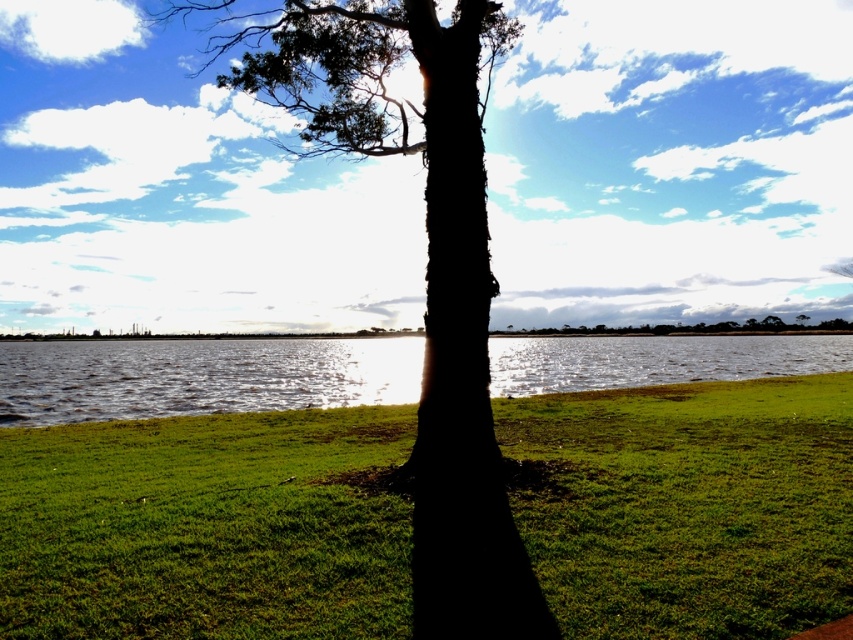
Can you confirm if green grassy at center is shorter than glistening water at center?

Yes, green grassy at center is shorter than glistening water at center.

Is the position of green grassy at center more distant than that of glistening water at center?

No, it is in front of glistening water at center.

Is point (624, 634) farther from viewer compared to point (625, 364)?

No, it is not.

This screenshot has width=853, height=640. In order to click on green grassy at center in this screenshot , I will do `click(207, 525)`.

Who is higher up, green grassy at center or dark bark tree at center?

dark bark tree at center is higher up.

Who is shorter, green grassy at center or dark bark tree at center?

green grassy at center

Where is `green grassy at center`? green grassy at center is located at coordinates (207, 525).

Is dark bark tree at center positioned before glistening water at center?

Yes, it is.

Is dark bark tree at center smaller than glistening water at center?

Actually, dark bark tree at center might be larger than glistening water at center.

You are a GUI agent. You are given a task and a screenshot of the screen. Output one action in this format:
    pyautogui.click(x=<x>, y=<y>)
    Task: Click on the dark bark tree at center
    The image size is (853, 640).
    Given the screenshot: What is the action you would take?
    pyautogui.click(x=424, y=275)

Find the location of a particular element. Image resolution: width=853 pixels, height=640 pixels. dark bark tree at center is located at coordinates (424, 275).